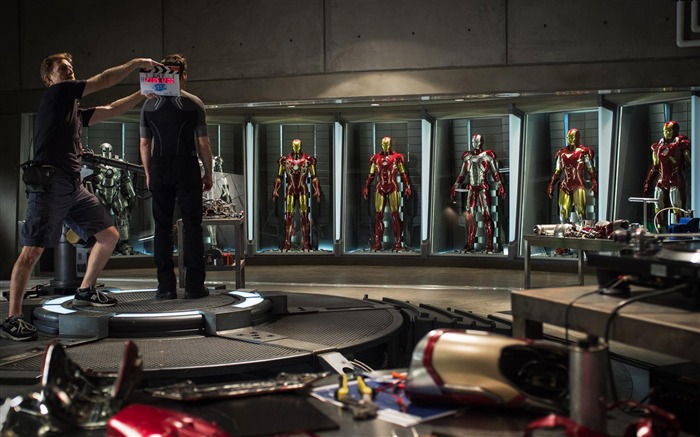
Image resolution: width=700 pixels, height=437 pixels. Find the location of `spotlight`. spotlight is located at coordinates (370, 90).